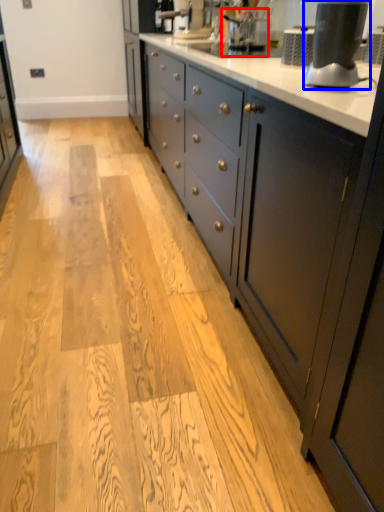
Question: Among these objects, which one is nearest to the camera, coffee machine (highlighted by a red box) or home appliance (highlighted by a blue box)?

Choices:
 (A) coffee machine
 (B) home appliance

Answer: (B)